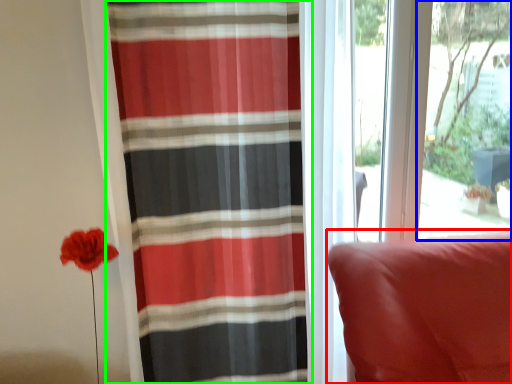
Question: Which object is the closest to the furniture (highlighted by a red box)? Choose among these: window screen (highlighted by a blue box) or curtain (highlighted by a green box).

Choices:
 (A) window screen
 (B) curtain

Answer: (B)